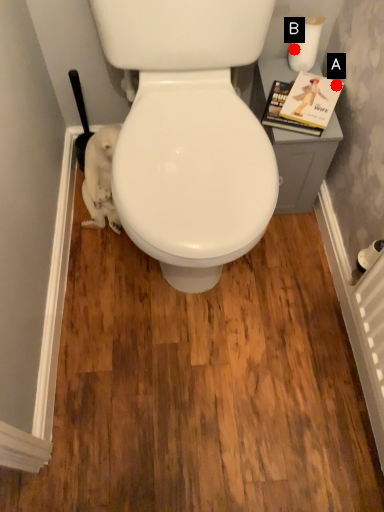
Question: Two points are circled on the image, labeled by A and B beside each circle. Which point is closer to the camera?

Choices:
 (A) A is closer
 (B) B is closer

Answer: (A)